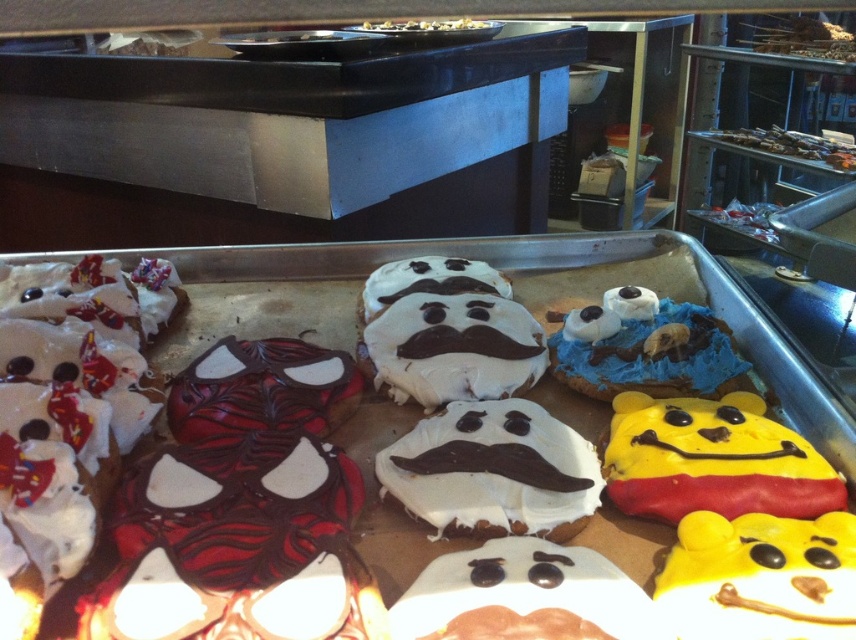
Is point (428, 465) farther from viewer compared to point (675, 387)?

No, it is in front of (675, 387).

Is point (556, 460) less distant than point (675, 305)?

Yes, it is in front of point (675, 305).

I want to click on white chocolate cookie with mustache at center, so click(492, 472).

Is white chocolate mustache at center to the left of shiny chocolate cookies at upper right from the viewer's perspective?

Correct, you'll find white chocolate mustache at center to the left of shiny chocolate cookies at upper right.

Is point (479, 381) farther from camera compared to point (782, 141)?

No, (479, 381) is closer to viewer.

This screenshot has height=640, width=856. Find the location of `white chocolate mustache at center`. white chocolate mustache at center is located at coordinates (455, 348).

Does white chocolate cookie with mustache at center appear under yellow matte winnie the pooh at right?

Correct, white chocolate cookie with mustache at center is located below yellow matte winnie the pooh at right.

Between white chocolate cookie with mustache at center and yellow matte winnie the pooh at right, which one has less height?

Standing shorter between the two is yellow matte winnie the pooh at right.

Who is more forward, (597, 499) or (714, 428)?

Point (597, 499) is more forward.

You are a GUI agent. You are given a task and a screenshot of the screen. Output one action in this format:
    pyautogui.click(x=<x>, y=<y>)
    Task: Click on the white chocolate cookie with mustache at center
    
    Given the screenshot: What is the action you would take?
    pyautogui.click(x=492, y=472)